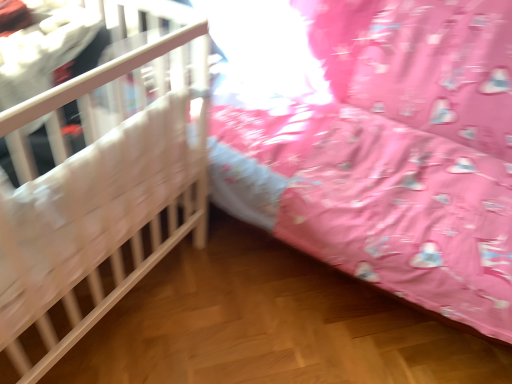
Question: Is wooden crib at left, which is the 2th infant bed from left to right, bigger than white wooden crib at left, which is the second infant bed from right to left?

Choices:
 (A) no
 (B) yes

Answer: (B)

Question: Is white wooden crib at left, which is the second infant bed from right to left, located within wooden crib at left, the 1th infant bed from the right?

Choices:
 (A) yes
 (B) no

Answer: (B)

Question: Is wooden crib at left, which is the 2th infant bed from left to right, aimed at white wooden crib at left, which is the second infant bed from right to left?

Choices:
 (A) yes
 (B) no

Answer: (A)

Question: Considering the relative positions of wooden crib at left, which is the 2th infant bed from left to right, and white wooden crib at left, which is the second infant bed from right to left, in the image provided, is wooden crib at left, which is the 2th infant bed from left to right, behind white wooden crib at left, which is the second infant bed from right to left,?

Choices:
 (A) yes
 (B) no

Answer: (A)

Question: From the image's perspective, is wooden crib at left, which is the 2th infant bed from left to right, below white wooden crib at left, which is the second infant bed from right to left?

Choices:
 (A) yes
 (B) no

Answer: (B)

Question: Is wooden crib at left, the 1th infant bed from the right, outside of white wooden crib at left, which is the second infant bed from right to left?

Choices:
 (A) no
 (B) yes

Answer: (B)

Question: From the image's perspective, does white wooden crib at left, positioned as the first infant bed in left-to-right order, appear lower than wooden crib at left, the 1th infant bed from the right?

Choices:
 (A) yes
 (B) no

Answer: (A)

Question: Is wooden crib at left, which is the 2th infant bed from left to right, located within white wooden crib at left, positioned as the first infant bed in left-to-right order?

Choices:
 (A) yes
 (B) no

Answer: (B)

Question: From a real-world perspective, is white wooden crib at left, which is the second infant bed from right to left, below wooden crib at left, which is the 2th infant bed from left to right?

Choices:
 (A) no
 (B) yes

Answer: (B)

Question: Can you confirm if white wooden crib at left, which is the second infant bed from right to left, is shorter than wooden crib at left, which is the 2th infant bed from left to right?

Choices:
 (A) yes
 (B) no

Answer: (A)

Question: Does white wooden crib at left, which is the second infant bed from right to left, appear on the right side of wooden crib at left, which is the 2th infant bed from left to right?

Choices:
 (A) no
 (B) yes

Answer: (A)

Question: From a real-world perspective, is white wooden crib at left, which is the second infant bed from right to left, over wooden crib at left, the 1th infant bed from the right?

Choices:
 (A) yes
 (B) no

Answer: (B)

Question: In the image, is white wooden crib at left, which is the second infant bed from right to left, positioned in front of or behind wooden crib at left, which is the 2th infant bed from left to right?

Choices:
 (A) front
 (B) behind

Answer: (A)